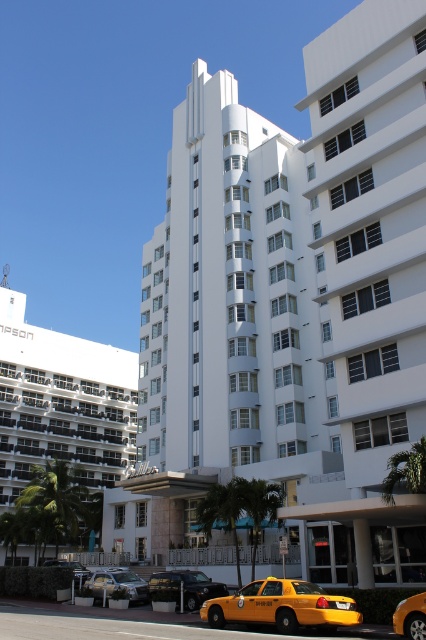
Question: Which of the following is the farthest from the observer?

Choices:
 (A) (103, 401)
 (B) (221, 592)

Answer: (A)

Question: Which object appears farthest from the camera in this image?

Choices:
 (A) metallic silver car at lower left
 (B) white smooth building at center
 (C) yellow matte taxi at lower center

Answer: (A)

Question: Which point is farther from the camera taking this photo?

Choices:
 (A) (154, 576)
 (B) (63, 563)

Answer: (B)

Question: Is metallic silver car at lower center to the right of yellow matte taxi at center from the viewer's perspective?

Choices:
 (A) yes
 (B) no

Answer: (B)

Question: Is white smooth building at center to the right of yellow matte taxi at lower center from the viewer's perspective?

Choices:
 (A) yes
 (B) no

Answer: (B)

Question: Does shiny black sedan at center lie in front of metallic silver car at lower center?

Choices:
 (A) no
 (B) yes

Answer: (B)